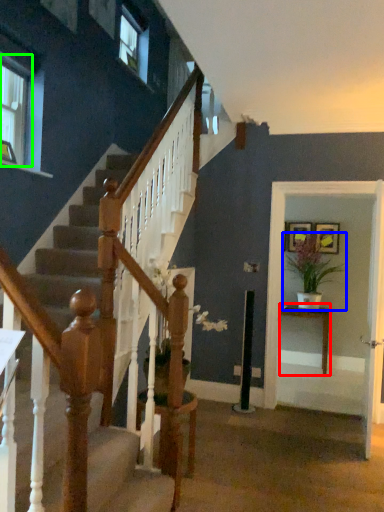
Question: Which object is positioned farthest from table (highlighted by a red box)? Select from houseplant (highlighted by a blue box) and window (highlighted by a green box).

Choices:
 (A) houseplant
 (B) window

Answer: (B)